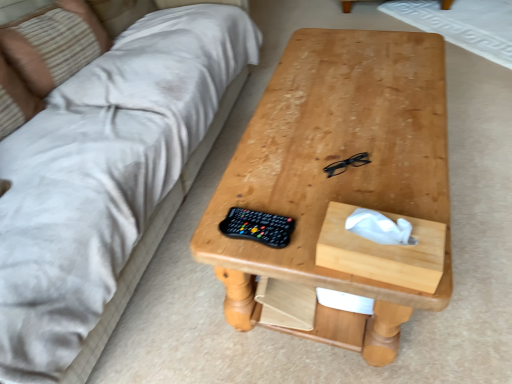
The width and height of the screenshot is (512, 384). In order to click on vacant area on top of natural wood table at center (from a real-world perspective) in this screenshot , I will do `click(349, 114)`.